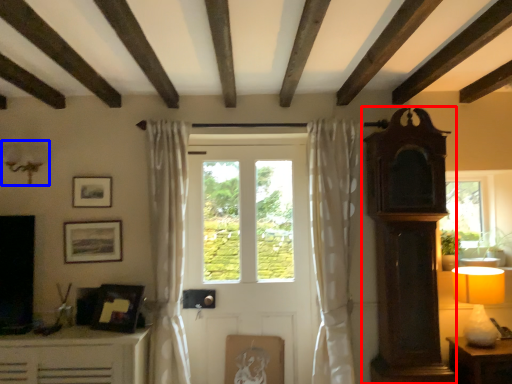
Question: Which of the following is the farthest to the observer, antique (highlighted by a red box) or lamp (highlighted by a blue box)?

Choices:
 (A) antique
 (B) lamp

Answer: (B)